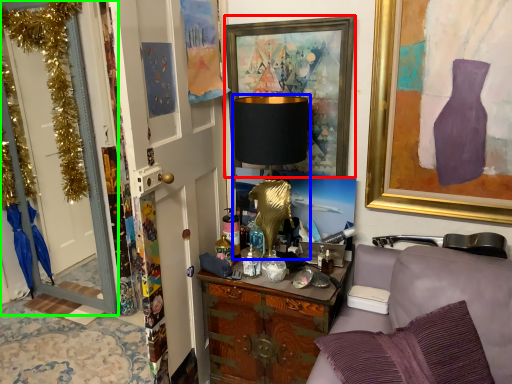
Question: Based on their relative distances, which object is farther from picture frame (highlighted by a red box)? Choose from table lamp (highlighted by a blue box) and door (highlighted by a green box).

Choices:
 (A) table lamp
 (B) door

Answer: (B)